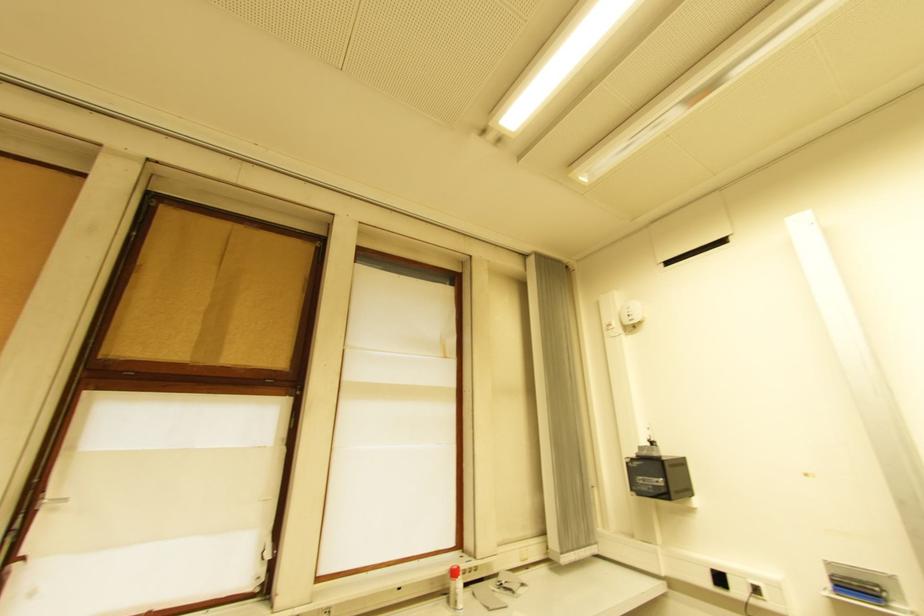
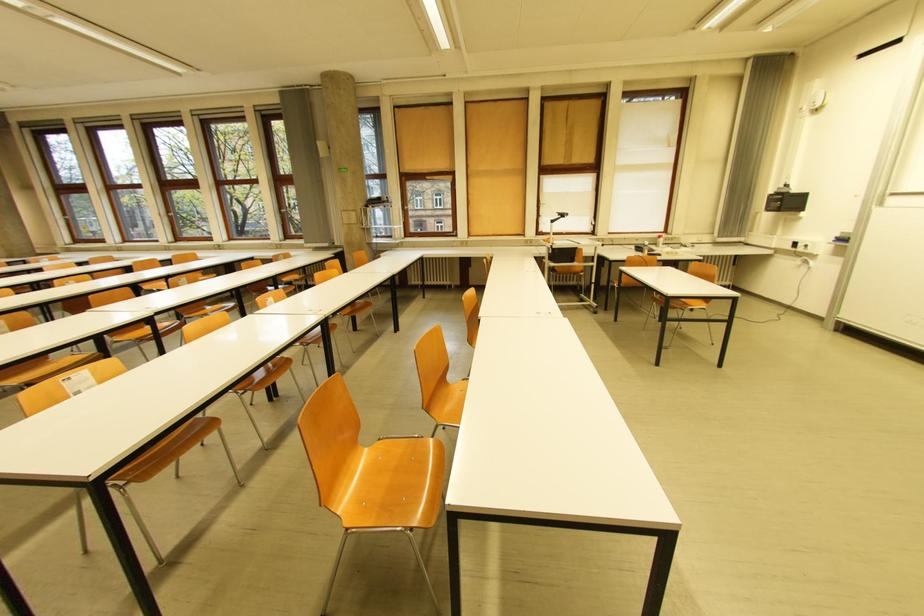
Where in the second image is the point corresponding to point (622, 294) from the first image?

(823, 82)